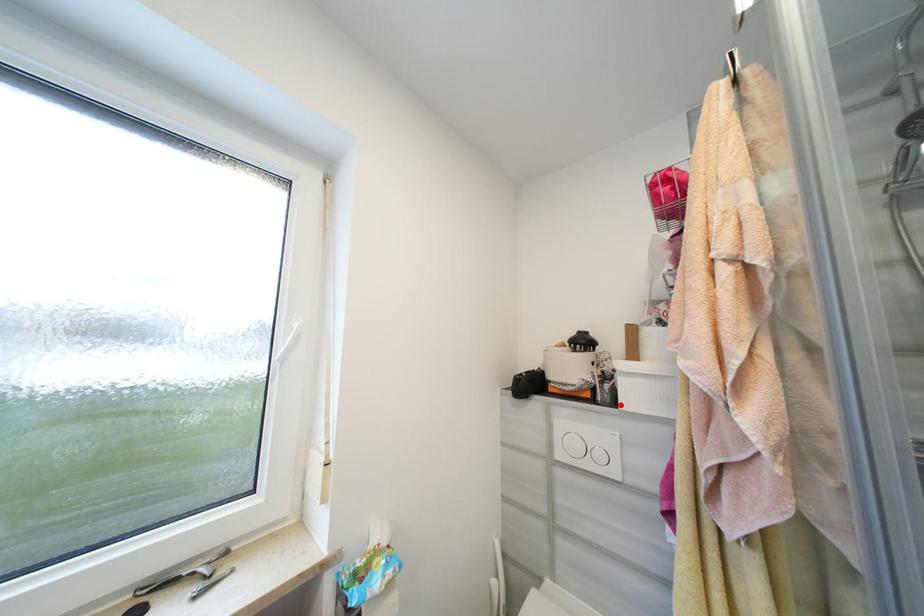
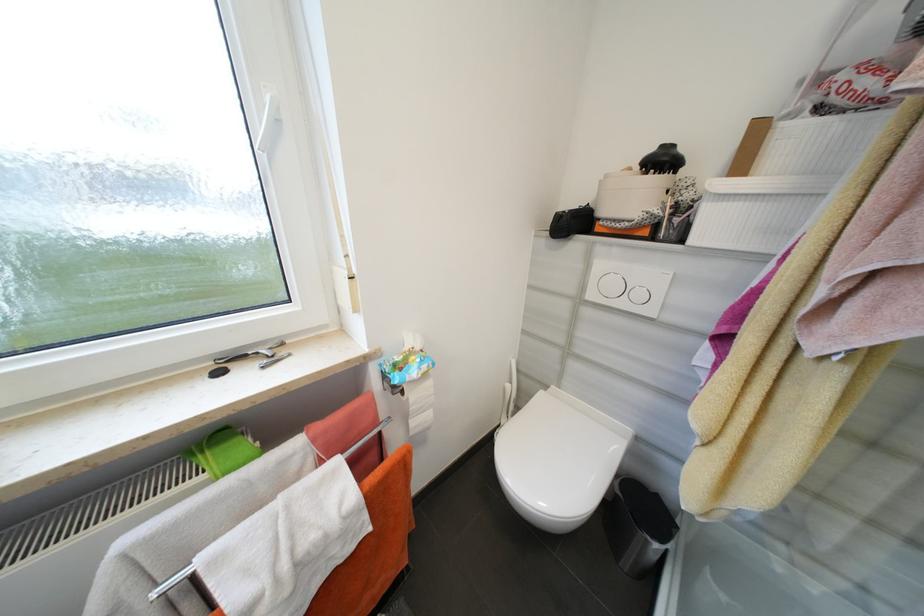
The point at the highlighted location is marked in the first image. Where is the corresponding point in the second image?

(687, 241)